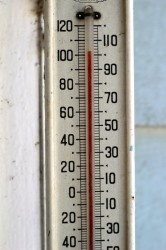
Where is `thermometer`? The width and height of the screenshot is (166, 250). thermometer is located at coordinates (110, 163).